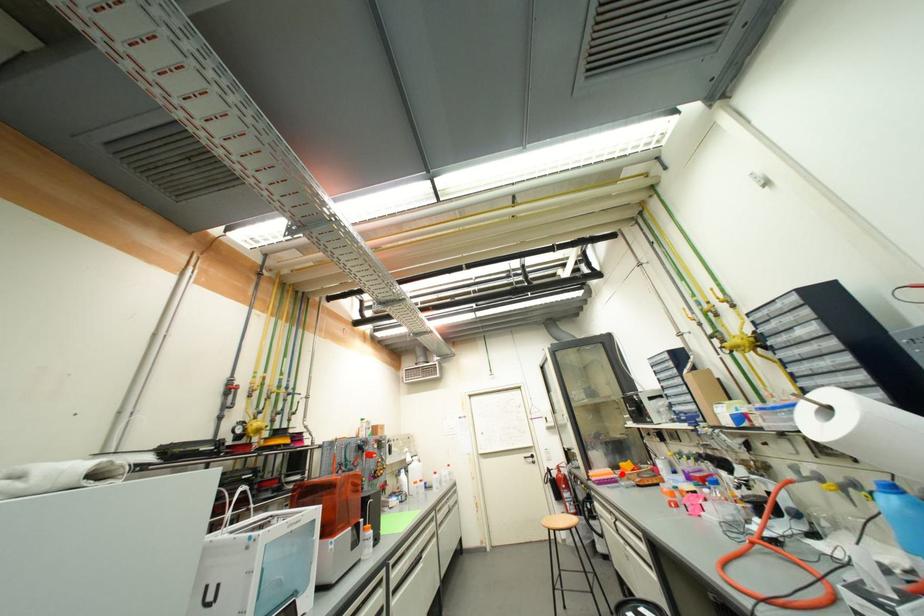
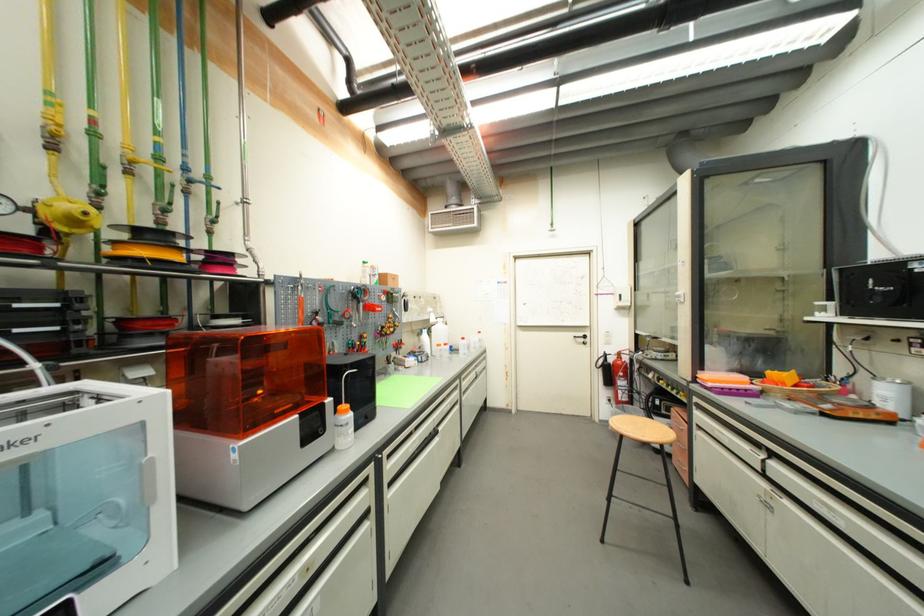
Locate, in the second image, the point that corresponds to the highlighted location in the first image.

(761, 383)